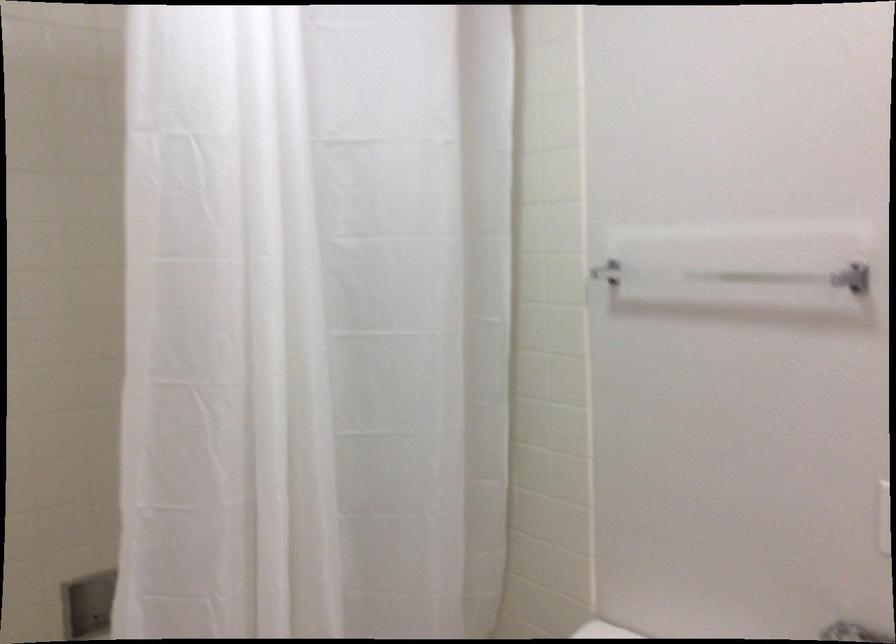
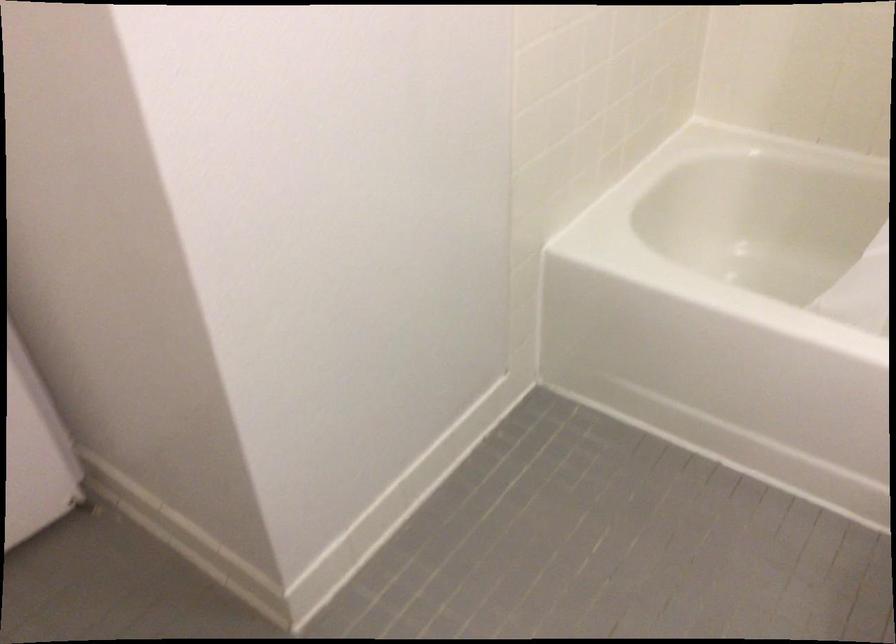
First-person continuous shooting, in which direction is the camera rotating?

The camera's rotation is toward left-down.